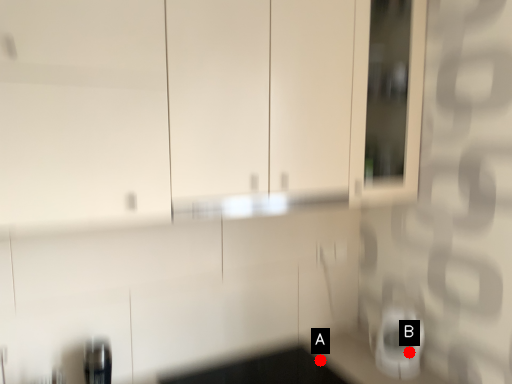
Question: Two points are circled on the image, labeled by A and B beside each circle. Among these points, which one is farthest from the camera?

Choices:
 (A) A is further
 (B) B is further

Answer: (A)